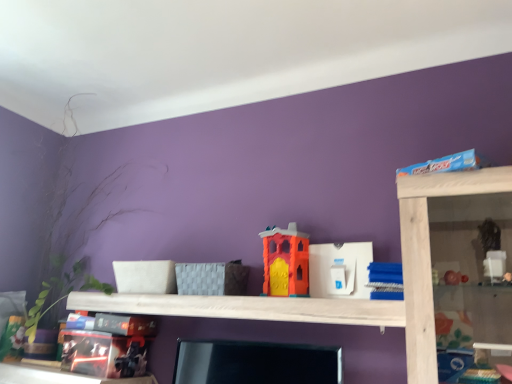
Question: Which direction should I rotate to look at orange matte plastic toy at center, marked as the 2th toy in a left-to-right arrangement, — up or down?

Choices:
 (A) down
 (B) up

Answer: (A)

Question: Can we say matt black toy at lower left, the fourth toy in the right-to-left sequence, lies outside blue plastic toy at upper right, the 1th toy viewed from the right?

Choices:
 (A) no
 (B) yes

Answer: (B)

Question: From a real-world perspective, is matt black toy at lower left, which is counted as the first toy, starting from the left, positioned under blue plastic toy at upper right, arranged as the fourth toy when viewed from the left, based on gravity?

Choices:
 (A) no
 (B) yes

Answer: (B)

Question: From the image's perspective, would you say matt black toy at lower left, the fourth toy in the right-to-left sequence, is shown under blue plastic toy at upper right, arranged as the fourth toy when viewed from the left?

Choices:
 (A) no
 (B) yes

Answer: (B)

Question: Is matt black toy at lower left, which is counted as the first toy, starting from the left, oriented away from blue plastic toy at upper right, arranged as the fourth toy when viewed from the left?

Choices:
 (A) no
 (B) yes

Answer: (A)

Question: Is matt black toy at lower left, the fourth toy in the right-to-left sequence, to the right of blue plastic toy at upper right, the 1th toy viewed from the right, from the viewer's perspective?

Choices:
 (A) no
 (B) yes

Answer: (A)

Question: From a real-world perspective, is matt black toy at lower left, which is counted as the first toy, starting from the left, on blue plastic toy at upper right, the 1th toy viewed from the right?

Choices:
 (A) yes
 (B) no

Answer: (B)

Question: Are blue plastic toy at upper right, the 1th toy viewed from the right, and white plastic toy at center, acting as the 3th toy starting from the left, beside each other?

Choices:
 (A) yes
 (B) no

Answer: (B)

Question: Is blue plastic toy at upper right, arranged as the fourth toy when viewed from the left, not within white plastic toy at center, acting as the 3th toy starting from the left?

Choices:
 (A) yes
 (B) no

Answer: (A)

Question: Considering the relative sizes of blue plastic toy at upper right, the 1th toy viewed from the right, and white plastic toy at center, acting as the 3th toy starting from the left, in the image provided, is blue plastic toy at upper right, the 1th toy viewed from the right, shorter than white plastic toy at center, acting as the 3th toy starting from the left,?

Choices:
 (A) yes
 (B) no

Answer: (A)

Question: Is blue plastic toy at upper right, arranged as the fourth toy when viewed from the left, not close to white plastic toy at center, marked as the 2th toy in a right-to-left arrangement?

Choices:
 (A) no
 (B) yes

Answer: (A)

Question: From a real-world perspective, is blue plastic toy at upper right, arranged as the fourth toy when viewed from the left, beneath white plastic toy at center, marked as the 2th toy in a right-to-left arrangement?

Choices:
 (A) yes
 (B) no

Answer: (A)

Question: Does blue plastic toy at upper right, arranged as the fourth toy when viewed from the left, have a greater width compared to white plastic toy at center, marked as the 2th toy in a right-to-left arrangement?

Choices:
 (A) yes
 (B) no

Answer: (A)

Question: Is white wood shelf at center facing away from matt black toy at lower left, which is counted as the first toy, starting from the left?

Choices:
 (A) no
 (B) yes

Answer: (A)